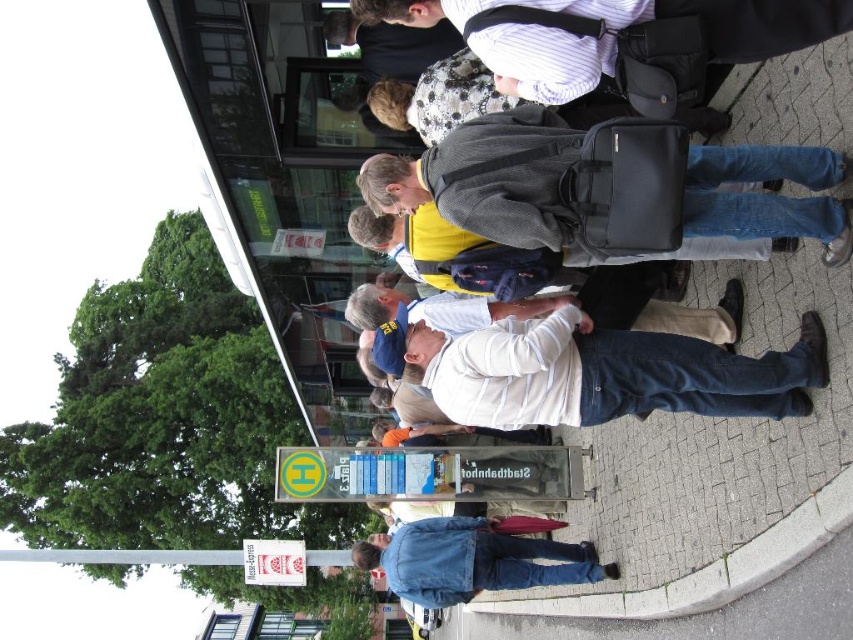
You are a delivery robot with a 10 meter maximum delivery range. You are currently positioned at the dark gray backpack at center and need to deliver a package to the denim jacket at lower right. Can you complete the delivery without exceeding your range?

The dark gray backpack at center and denim jacket at lower right are 10.13 meters apart from each other. Since the delivery robot has a maximum range of 10 meters, it cannot complete the delivery as the distance exceeds its capability.

You are a delivery person trying to navigate through the crowd at the bus stop. You need to reach the bus stop sign in the center. There is a dark gray backpack at center and a denim jacket at lower right in your way. Which object should you move around to get to the sign without going through the people?

You should move around the denim jacket at lower right because the dark gray backpack at center is in front of it, meaning the backpack is closer to you. Going around the denim jacket at lower right would allow you to reach the bus stop sign without passing through the people in front.